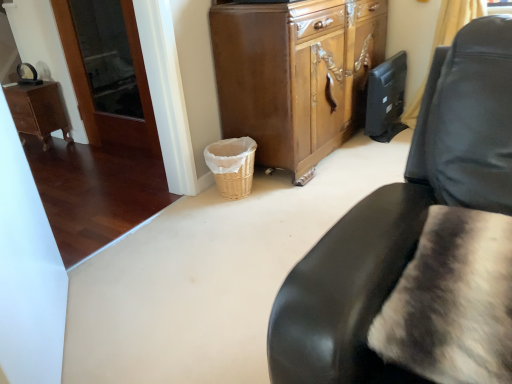
Question: Can you confirm if yellow fabric curtain at upper right is shorter than wooden cabinet at center?

Choices:
 (A) no
 (B) yes

Answer: (B)

Question: Can you confirm if yellow fabric curtain at upper right is wider than wooden cabinet at center?

Choices:
 (A) yes
 (B) no

Answer: (B)

Question: Is yellow fabric curtain at upper right positioned with its back to wooden cabinet at center?

Choices:
 (A) yes
 (B) no

Answer: (B)

Question: Considering the relative sizes of yellow fabric curtain at upper right and wooden cabinet at center in the image provided, is yellow fabric curtain at upper right thinner than wooden cabinet at center?

Choices:
 (A) no
 (B) yes

Answer: (B)

Question: Is yellow fabric curtain at upper right further to the viewer compared to wooden cabinet at center?

Choices:
 (A) yes
 (B) no

Answer: (A)

Question: Is yellow fabric curtain at upper right at the right side of wooden cabinet at center?

Choices:
 (A) no
 (B) yes

Answer: (B)

Question: Is wooden cabinet at center turned away from woven wicker basket at lower center?

Choices:
 (A) yes
 (B) no

Answer: (B)

Question: Would you say woven wicker basket at lower center is part of wooden cabinet at center's contents?

Choices:
 (A) no
 (B) yes

Answer: (A)

Question: Considering the relative positions of wooden cabinet at center and woven wicker basket at lower center in the image provided, is wooden cabinet at center in front of woven wicker basket at lower center?

Choices:
 (A) yes
 (B) no

Answer: (A)

Question: From the image's perspective, is wooden cabinet at center on woven wicker basket at lower center?

Choices:
 (A) no
 (B) yes

Answer: (B)

Question: Considering the relative sizes of wooden cabinet at center and woven wicker basket at lower center in the image provided, is wooden cabinet at center taller than woven wicker basket at lower center?

Choices:
 (A) yes
 (B) no

Answer: (A)

Question: From the image's perspective, is wooden cabinet at center beneath woven wicker basket at lower center?

Choices:
 (A) no
 (B) yes

Answer: (A)

Question: From the image's perspective, is fuzzy fur pillow at lower right beneath wooden desk at left?

Choices:
 (A) no
 (B) yes

Answer: (B)